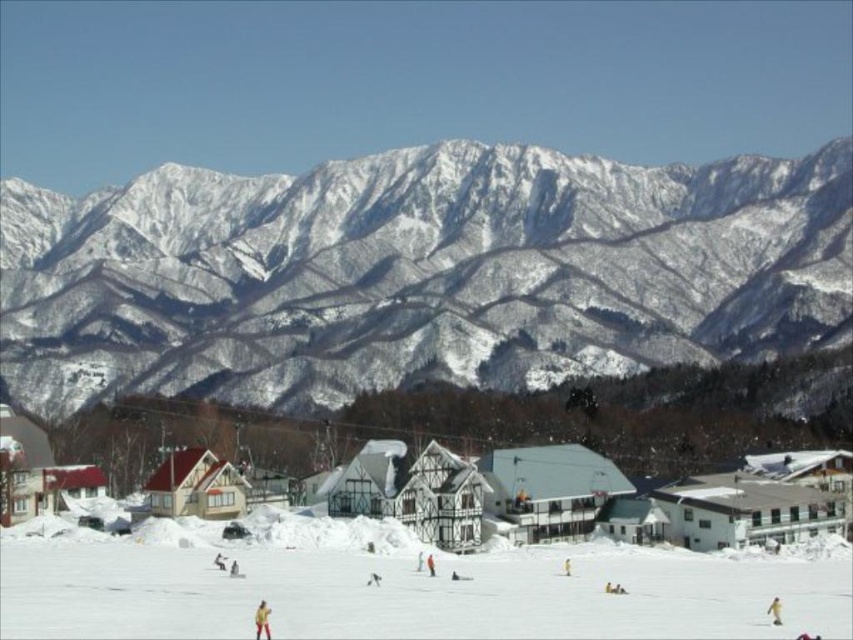
Question: Which point appears farthest from the camera in this image?

Choices:
 (A) (244, 365)
 (B) (431, 566)

Answer: (A)

Question: Which object is closer to the camera taking this photo?

Choices:
 (A) orange ski suit at center
 (B) white wooden houses at center
 (C) yellow snowsuit at center

Answer: (C)

Question: Can you confirm if yellow fabric skier at center is bigger than yellow snowsuit at center?

Choices:
 (A) no
 (B) yes

Answer: (B)

Question: Is yellow fabric skier at center thinner than yellow fabric person at center?

Choices:
 (A) yes
 (B) no

Answer: (B)

Question: Does yellow fabric skier at center have a greater width compared to yellow fabric person at center?

Choices:
 (A) yes
 (B) no

Answer: (A)

Question: Which of the following is the farthest from the observer?

Choices:
 (A) 422,525
 (B) 776,596
 (C) 218,563
 (D) 566,572

Answer: (A)